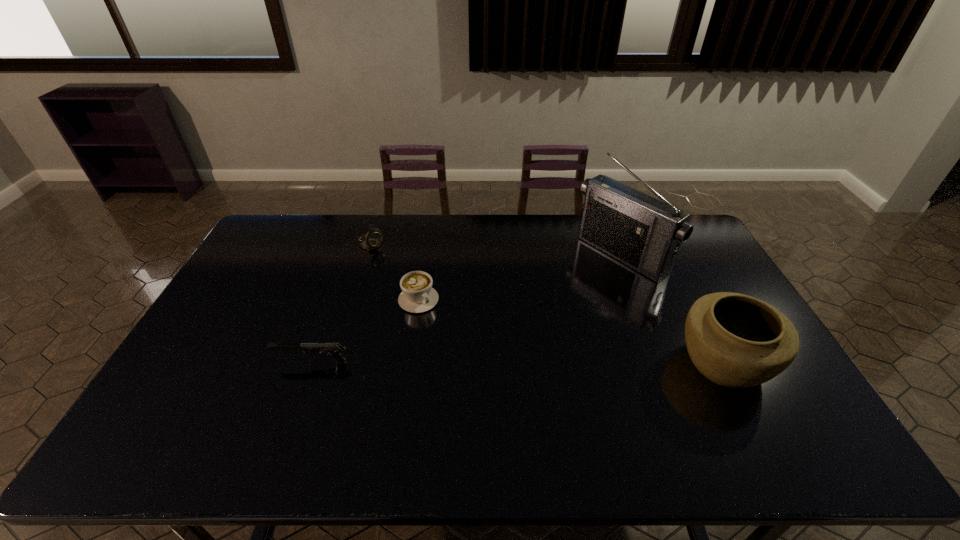
Where is `gun`? This screenshot has height=540, width=960. gun is located at coordinates (334, 349).

Identify the location of pottery. (735, 340).

Image resolution: width=960 pixels, height=540 pixels. I want to click on the third shortest object, so click(x=372, y=240).

Where is `cappuccino`? cappuccino is located at coordinates (417, 295).

At what (x,y) coordinates should I click in order to perform the action: click on radio receiver. Please return your answer as a coordinate pair (x, y). Looking at the image, I should click on (645, 233).

The image size is (960, 540). Find the location of `blank area located at the muzzle end of the gun`. blank area located at the muzzle end of the gun is located at coordinates (226, 362).

The height and width of the screenshot is (540, 960). In order to click on vacant point located at the muzzle end of the gun in this screenshot , I will do `click(211, 362)`.

In order to click on vacant space situated 0.140m at the muzzle end of the gun in this screenshot , I will do `click(226, 362)`.

I want to click on vacant area situated 0.370m on the back of the second tallest object, so click(666, 252).

Find the location of a particular element. free space located 0.310m on the face of the third shortest object is located at coordinates (432, 294).